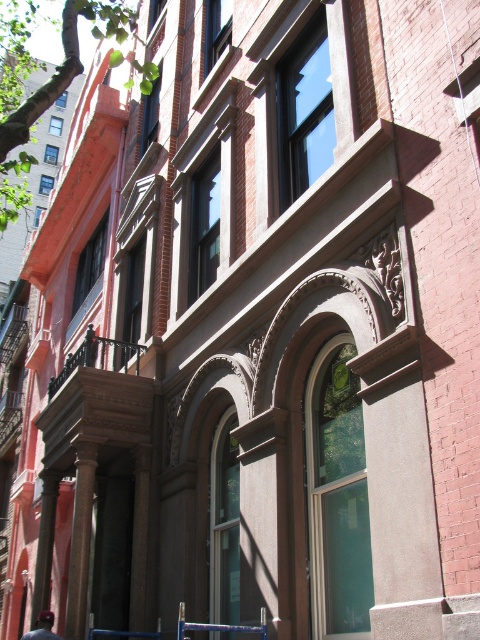
You are standing in front of the building and notice the brown wooden railing at upper left and the dark blue baseball cap at lower left. Which object is smaller in size?

The brown wooden railing at upper left is smaller in size compared to the dark blue baseball cap at lower left.

You are standing in front of the multi story brick building and see the brown wooden railing at upper left and the dark blue baseball cap at lower left. Which object is positioned to the right of the other?

The brown wooden railing at upper left is to the right of dark blue baseball cap at lower left.

You are a window cleaner standing on the brown wooden railing at upper left and need to reach the dark blue baseball cap at lower left. The cap is 21.77 feet away from you. If your longest cleaning pole can extend up to 20 feet, can you safely reach the cap without moving from your current position?

The brown wooden railing at upper left and dark blue baseball cap at lower left are 21.77 feet apart. Since your pole only extends to 20 feet, you cannot safely reach the cap from your current position.